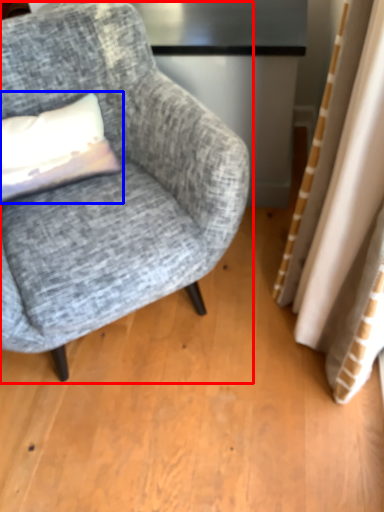
Question: Which object appears closest to the camera in this image, chair (highlighted by a red box) or pillow (highlighted by a blue box)?

Choices:
 (A) chair
 (B) pillow

Answer: (A)